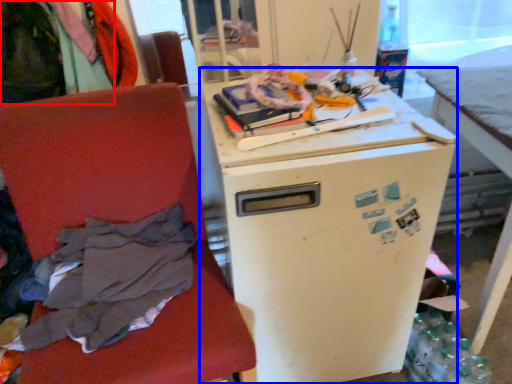
Question: Among these objects, which one is nearest to the camera, clothing (highlighted by a red box) or refrigerator (highlighted by a blue box)?

Choices:
 (A) clothing
 (B) refrigerator

Answer: (B)